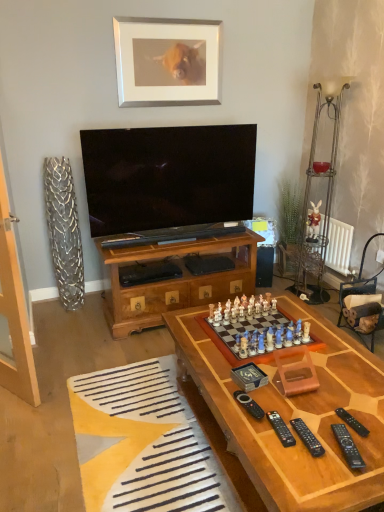
Where is `free region on the left part of black plastic remote at lower right, the 4th remote in the right-to-left sequence`? free region on the left part of black plastic remote at lower right, the 4th remote in the right-to-left sequence is located at coordinates (249, 430).